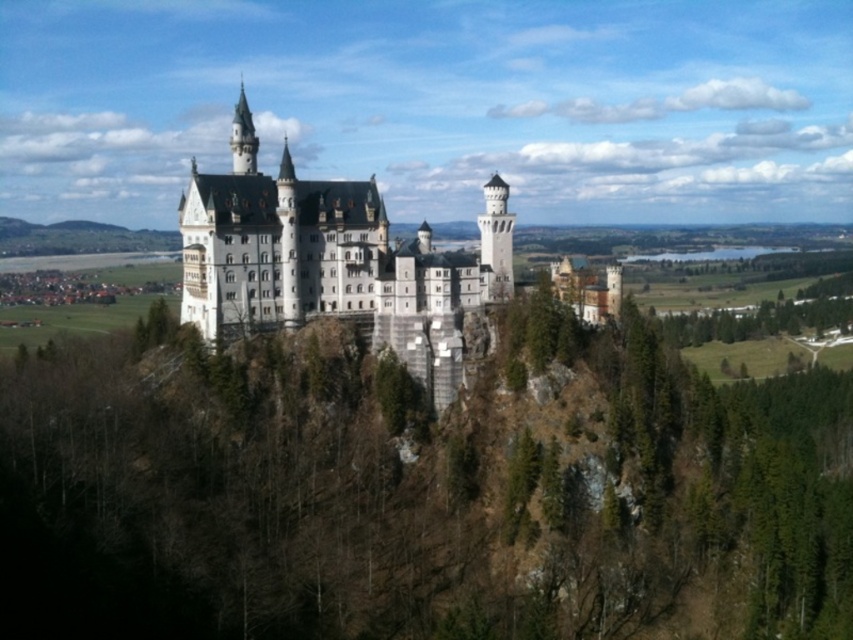
Question: Is green leafy trees at center positioned before white stone castle at center?

Choices:
 (A) no
 (B) yes

Answer: (B)

Question: Does green leafy trees at center appear under white stone castle at center?

Choices:
 (A) yes
 (B) no

Answer: (A)

Question: Which point is farther from the camera taking this photo?

Choices:
 (A) 225,248
 (B) 314,429

Answer: (A)

Question: Which point is closer to the camera?

Choices:
 (A) green leafy trees at center
 (B) white stone castle at center

Answer: (A)

Question: Does green leafy trees at center appear on the right side of white stone castle at center?

Choices:
 (A) yes
 (B) no

Answer: (A)